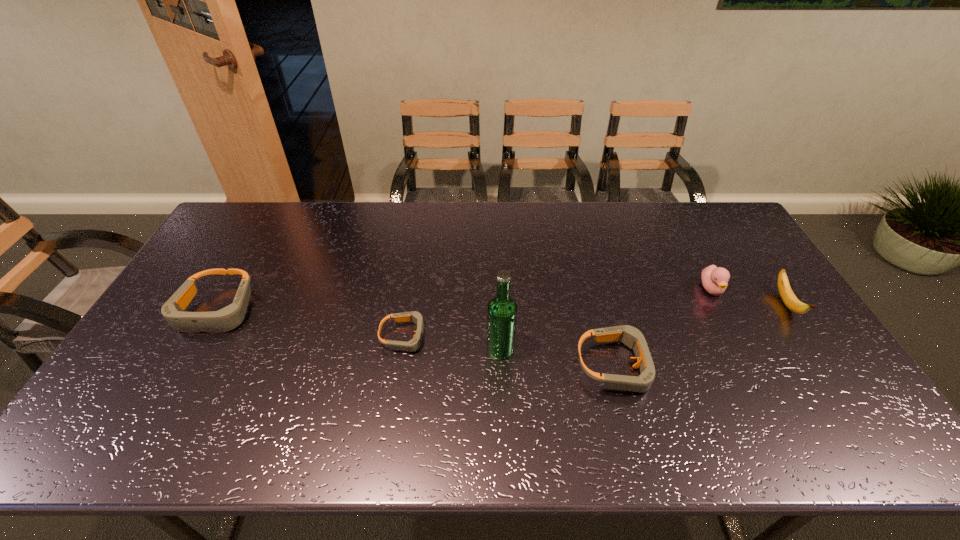
Locate an element on the screen. free area in between the banana and the shortest object is located at coordinates (595, 320).

At what (x,y) coordinates should I click in order to perform the action: click on object that ranks as the fourth closest to the third object from left to right. Please return your answer as a coordinate pair (x, y). Image resolution: width=960 pixels, height=540 pixels. Looking at the image, I should click on (228, 318).

Where is `object that is the second closest to the fourth object from right to left`? The height and width of the screenshot is (540, 960). object that is the second closest to the fourth object from right to left is located at coordinates (633, 338).

Identify which goggles is the second closest to the beer bottle. Please provide its 2D coordinates. Your answer should be formatted as a tuple, i.e. [(x, y)], where the tuple contains the x and y coordinates of a point satisfying the conditions above.

[(633, 338)]

You are a GUI agent. You are given a task and a screenshot of the screen. Output one action in this format:
    pyautogui.click(x=<x>, y=<y>)
    Task: Click on the goggles identified as the second closest to the leftmost goggles
    Image resolution: width=960 pixels, height=540 pixels.
    Given the screenshot: What is the action you would take?
    pyautogui.click(x=633, y=338)

The image size is (960, 540). Find the location of `free point that satisfies the following two spatial constraints: 1. on the front-facing side of the second object from right to left; 2. on the front and back of the rightmost goggles`. free point that satisfies the following two spatial constraints: 1. on the front-facing side of the second object from right to left; 2. on the front and back of the rightmost goggles is located at coordinates (752, 366).

Identify the location of vacant area in the image that satisfies the following two spatial constraints: 1. on the front-facing side of the second object from right to left; 2. on the front and back of the rightmost goggles. (752, 366).